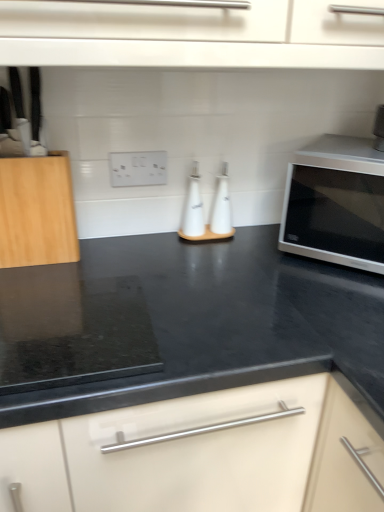
Question: From a real-world perspective, is satin silver microwave at right over white matte oil bottle at center, which ranks as the 2th bottle in right-to-left order?

Choices:
 (A) yes
 (B) no

Answer: (A)

Question: Does satin silver microwave at right lie behind white matte oil bottle at center, which ranks as the 2th bottle in right-to-left order?

Choices:
 (A) no
 (B) yes

Answer: (A)

Question: Can you confirm if satin silver microwave at right is thinner than white matte oil bottle at center, which ranks as the 2th bottle in right-to-left order?

Choices:
 (A) no
 (B) yes

Answer: (A)

Question: Is satin silver microwave at right oriented away from white matte oil bottle at center, which ranks as the 2th bottle in right-to-left order?

Choices:
 (A) yes
 (B) no

Answer: (B)

Question: Does satin silver microwave at right have a smaller size compared to white matte oil bottle at center, which is the 1th bottle in left-to-right order?

Choices:
 (A) no
 (B) yes

Answer: (A)

Question: Considering the positions of natural wood cutting board at left and white glossy bottle at center, placed as the first bottle when sorted from right to left, in the image, is natural wood cutting board at left wider or thinner than white glossy bottle at center, placed as the first bottle when sorted from right to left,?

Choices:
 (A) wide
 (B) thin

Answer: (A)

Question: From a real-world perspective, is natural wood cutting board at left physically located above or below white glossy bottle at center, the second bottle from the left?

Choices:
 (A) above
 (B) below

Answer: (A)

Question: From the image's perspective, relative to white glossy bottle at center, the second bottle from the left, is natural wood cutting board at left above or below?

Choices:
 (A) above
 (B) below

Answer: (A)

Question: Considering their positions, is natural wood cutting board at left located in front of or behind white glossy bottle at center, placed as the first bottle when sorted from right to left?

Choices:
 (A) behind
 (B) front

Answer: (B)

Question: Is white matte oil bottle at center, which is the 1th bottle in left-to-right order, taller or shorter than satin silver microwave at right?

Choices:
 (A) tall
 (B) short

Answer: (B)

Question: Do you think white matte oil bottle at center, which ranks as the 2th bottle in right-to-left order, is within satin silver microwave at right, or outside of it?

Choices:
 (A) inside
 (B) outside

Answer: (B)

Question: In terms of width, does white matte oil bottle at center, which ranks as the 2th bottle in right-to-left order, look wider or thinner when compared to satin silver microwave at right?

Choices:
 (A) thin
 (B) wide

Answer: (A)

Question: Would you say white matte oil bottle at center, which is the 1th bottle in left-to-right order, is to the left or to the right of satin silver microwave at right in the picture?

Choices:
 (A) right
 (B) left

Answer: (B)

Question: Which is correct: white plastic electric outlet at center is inside white matte oil bottle at center, which ranks as the 2th bottle in right-to-left order, or outside of it?

Choices:
 (A) inside
 (B) outside

Answer: (B)

Question: Does point (142, 165) appear closer or farther from the camera than point (190, 187)?

Choices:
 (A) closer
 (B) farther

Answer: (A)